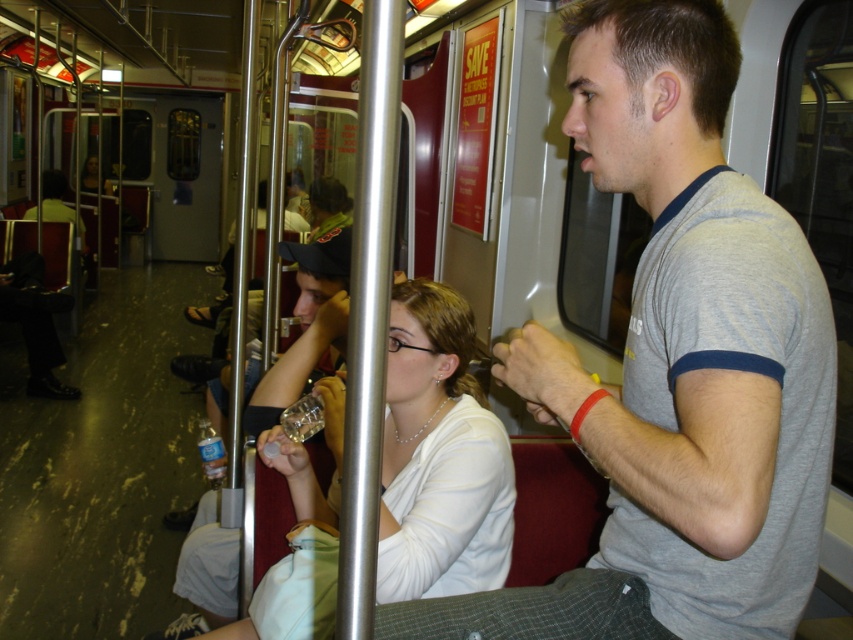
What do you see at coordinates (439, 456) in the screenshot?
I see `white matte shirt at center` at bounding box center [439, 456].

Is white matte shirt at center bigger than translucent plastic bottle at lower left?

Yes.

This screenshot has height=640, width=853. In order to click on white matte shirt at center in this screenshot , I will do [439, 456].